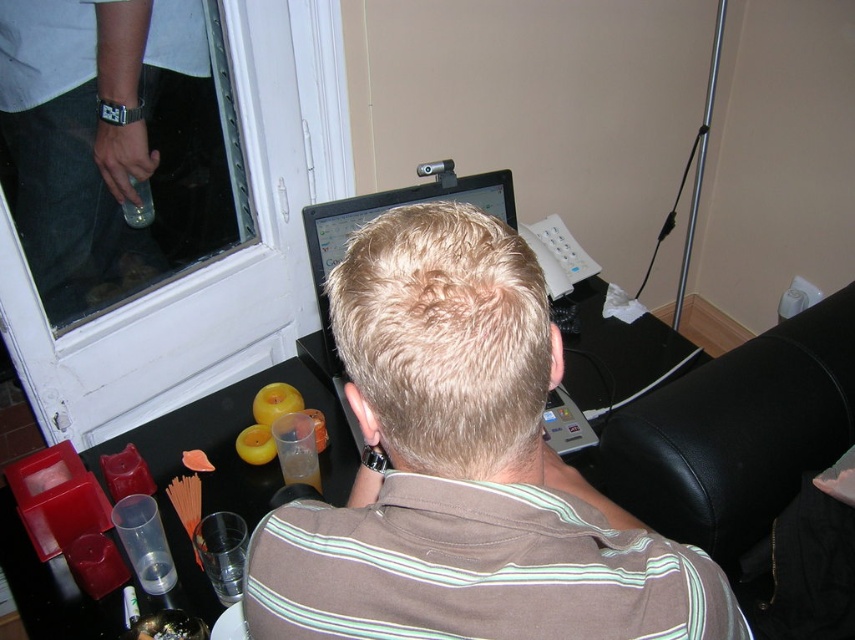
Measure the distance between brown striped shirt at center and camera.

A distance of 18.72 inches exists between brown striped shirt at center and camera.

Between brown striped shirt at center and matte black monitor at upper center, which one appears on the left side from the viewer's perspective?

matte black monitor at upper center

Is point (531, 548) positioned before point (496, 200)?

Yes, it is.

Image resolution: width=855 pixels, height=640 pixels. I want to click on brown striped shirt at center, so click(x=463, y=468).

Is point (178, 253) closer to camera compared to point (346, 214)?

No, (178, 253) is behind (346, 214).

You are a GUI agent. You are given a task and a screenshot of the screen. Output one action in this format:
    pyautogui.click(x=<x>, y=<y>)
    Task: Click on the transparent glass door at upper left
    Image resolution: width=855 pixels, height=640 pixels.
    Given the screenshot: What is the action you would take?
    pyautogui.click(x=116, y=145)

Can you confirm if black leather chair at right is wider than black plastic monitor at center?

Indeed, black leather chair at right has a greater width compared to black plastic monitor at center.

Does black leather chair at right have a lesser width compared to black plastic monitor at center?

In fact, black leather chair at right might be wider than black plastic monitor at center.

Who is more distant from viewer, [640,436] or [575,424]?

Positioned behind is point [575,424].

The width and height of the screenshot is (855, 640). What are the coordinates of `black leather chair at right` in the screenshot? It's located at (736, 433).